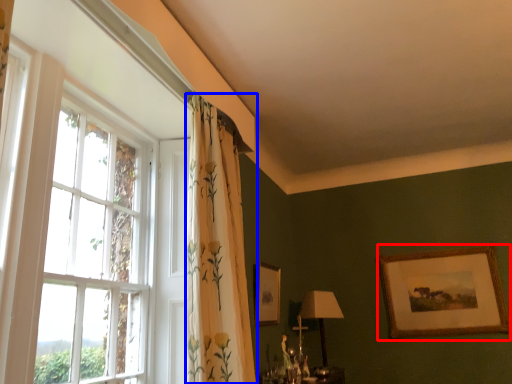
Question: Which point is further to the camera, picture frame (highlighted by a red box) or curtain (highlighted by a blue box)?

Choices:
 (A) picture frame
 (B) curtain

Answer: (A)